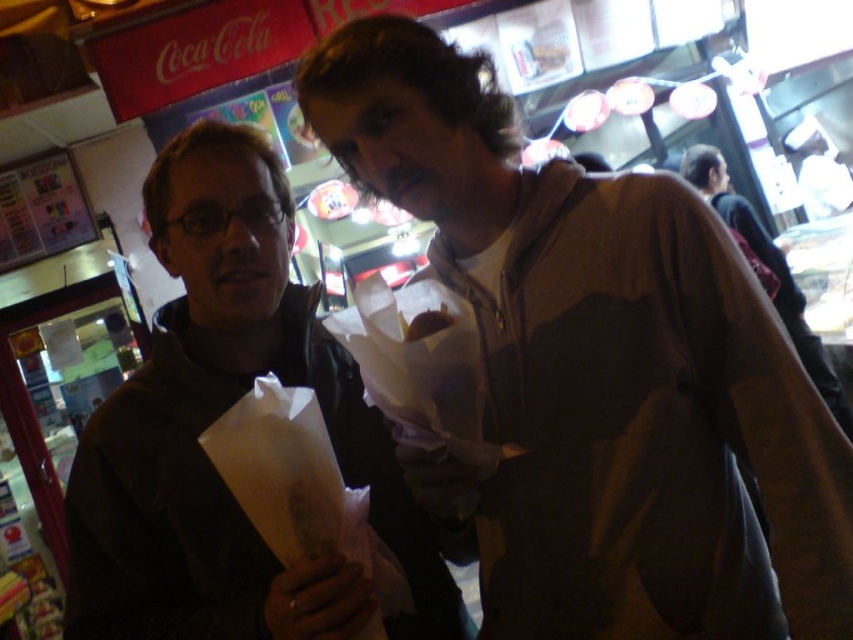
You are standing in the market and want to find the dark brown jacket at center. According to the coordinates provided, where should you look relative to the Coca Cola sign in the upper left corner?

The dark brown jacket at center is located at point 0.655 in the x coordinate and 0.253 in the y coordinate, which is to the right and slightly below the Coca Cola sign in the upper left corner.

You are standing at the camera position and want to reach point (601, 292). Can you walk directly to it without moving around any obstacles?

The distance between you and point (601, 292) is 39.19 inches. Since there are no obstacles mentioned in the scene, you can walk directly to it.